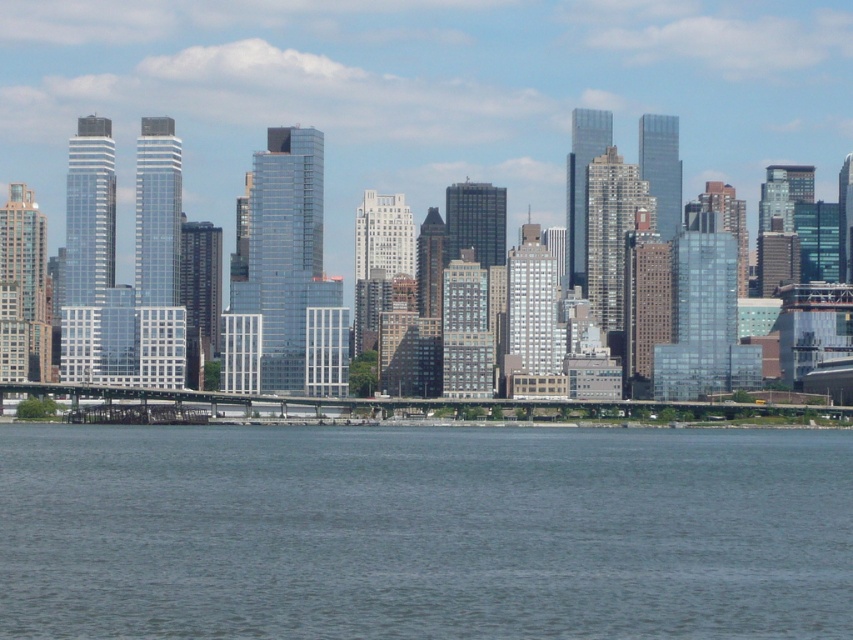
You are standing at the waterfront in the image and want to reach the point marked as point (653, 436). Given that you can walk at a speed of 5 km per hour, how long would it take you to reach that point?

The distance between you and point (653, 436) is 658.06 meters. At a walking speed of 5 km per hour, it would take approximately 8 minutes and 10 seconds to reach the point.

You are standing at the point marked by coordinates point (422,531) in the image. Looking around, what is the most prominent feature directly below you?

The point (422,531) corresponds to the blue water at lower center, so the most prominent feature directly below you is the blue water at lower center.

You are a photographer planning to capture the city skyline. You have a camera with a wide angle lens that can capture large structures but struggles with small details. Which object between the blue water at lower center and the glassy skyscrapers at center would be better suited for your lens?

The glassy skyscrapers at center are better suited for your wide angle lens since they are larger than the blue water at lower center, allowing the lens to capture their size and structure more effectively.